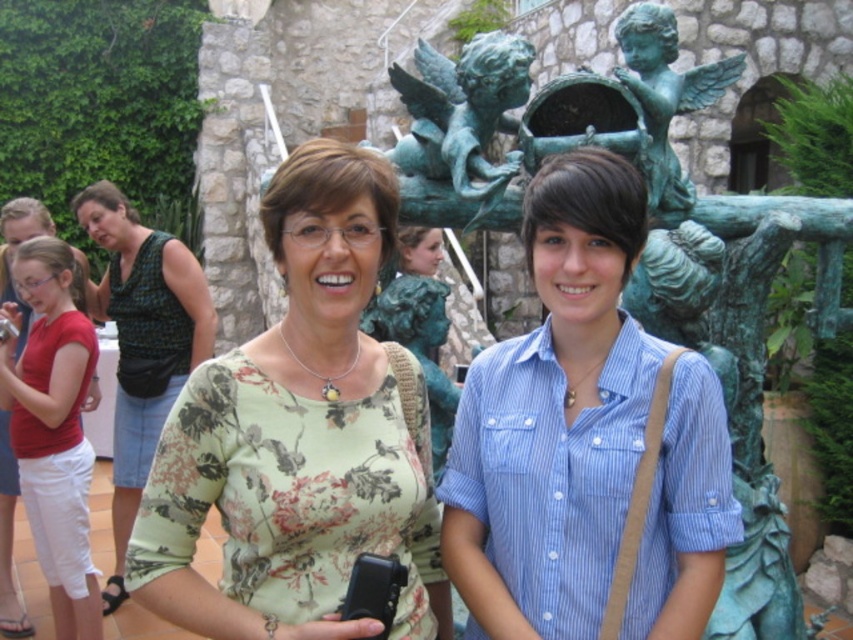
Consider the image. Does floral print blouse at center have a lesser width compared to blue striped shirt at center?

No, floral print blouse at center is not thinner than blue striped shirt at center.

Which is more to the right, floral print blouse at center or blue striped shirt at center?

Positioned to the right is blue striped shirt at center.

You are a GUI agent. You are given a task and a screenshot of the screen. Output one action in this format:
    pyautogui.click(x=<x>, y=<y>)
    Task: Click on the floral print blouse at center
    The width and height of the screenshot is (853, 640).
    Given the screenshot: What is the action you would take?
    pyautogui.click(x=299, y=436)

Between floral print blouse at center and matte red shirt at left, which one is positioned higher?

floral print blouse at center

Which of these two, floral print blouse at center or matte red shirt at left, stands taller?

With more height is matte red shirt at left.

Where is `floral print blouse at center`? floral print blouse at center is located at coordinates (299, 436).

Where is `floral print blouse at center`? floral print blouse at center is located at coordinates (299, 436).

Is blue striped shirt at center below matte red shirt at left?

Yes, blue striped shirt at center is below matte red shirt at left.

Is blue striped shirt at center behind matte red shirt at left?

No, it is in front of matte red shirt at left.

What do you see at coordinates (554, 417) in the screenshot? I see `blue striped shirt at center` at bounding box center [554, 417].

What are the coordinates of `blue striped shirt at center` in the screenshot? It's located at pyautogui.click(x=554, y=417).